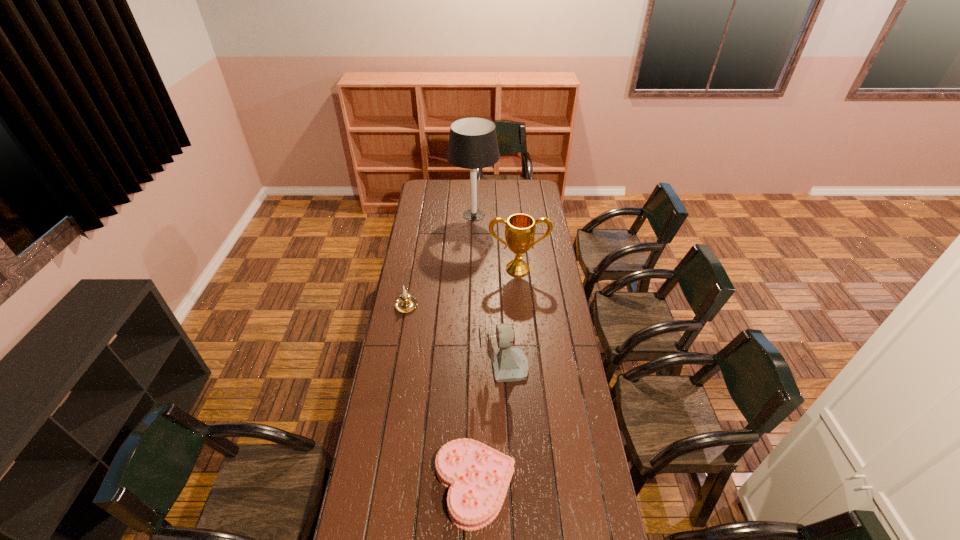
The width and height of the screenshot is (960, 540). I want to click on the farthest object, so click(x=473, y=144).

In order to click on table lamp in this screenshot , I will do `click(473, 144)`.

What are the coordinates of `the second nearest object` in the screenshot? It's located at (508, 364).

You are a GUI agent. You are given a task and a screenshot of the screen. Output one action in this format:
    pyautogui.click(x=<x>, y=<y>)
    Task: Click on the award
    The height and width of the screenshot is (540, 960).
    Given the screenshot: What is the action you would take?
    pyautogui.click(x=520, y=228)

I want to click on the third farthest object, so pos(406,302).

Find the location of a particular element. the second shortest object is located at coordinates (406, 302).

Locate an element on the screen. Image resolution: width=960 pixels, height=540 pixels. cake is located at coordinates (477, 476).

The image size is (960, 540). I want to click on the nearest object, so click(x=477, y=476).

What are the coordinates of `vacant region located 0.090m on the right of the farthest object` in the screenshot? It's located at (513, 215).

The image size is (960, 540). I want to click on free space located 0.390m in front of the fan to blow air, so click(x=385, y=368).